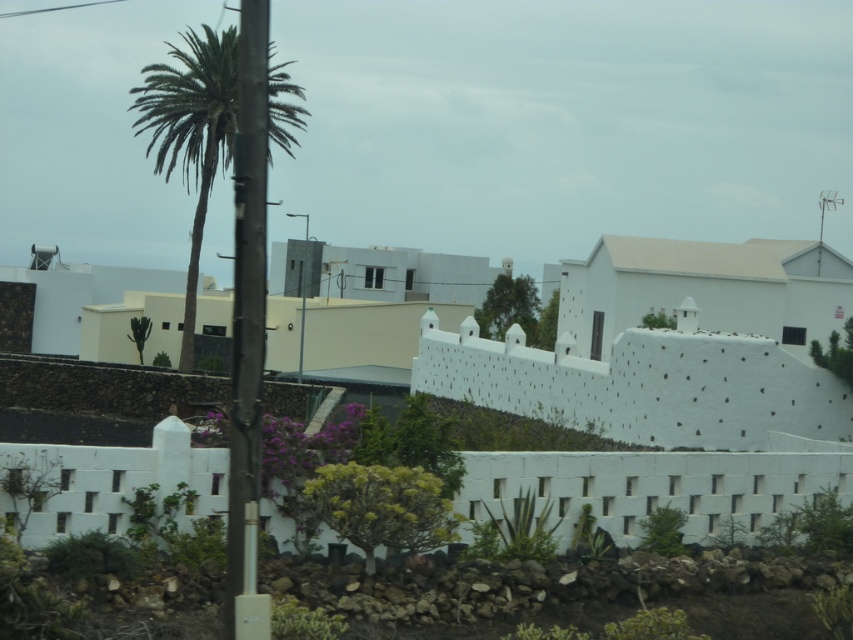
You are standing in the residential area depicted in the image. You notice a point marked at coordinates (659,484). Based on the scene description, what object does this point correspond to?

The point at coordinates (659,484) corresponds to the white concrete wall at center as described in the scene.

Consider the image. You are standing in a residential area with Mediterranean architecture. You see a white wall with plants and a palm tree on the left. There is also a metallic pole at left located at point (247, 307). Can you confirm if the metallic pole at left is near the palm tree on the left?

The metallic pole at left is located at point (247, 307), which is near the palm tree on the left.